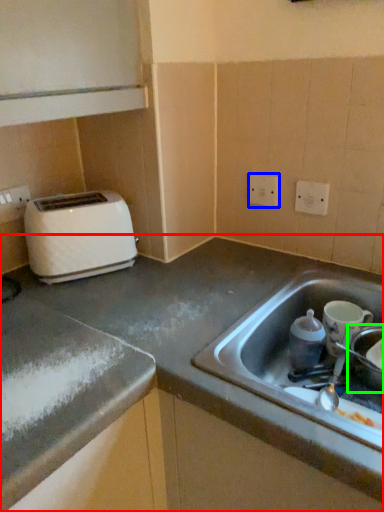
Question: Which is farther away from countertop (highlighted by a red box)? electric outlet (highlighted by a blue box) or appliance (highlighted by a green box)?

Choices:
 (A) electric outlet
 (B) appliance

Answer: (A)